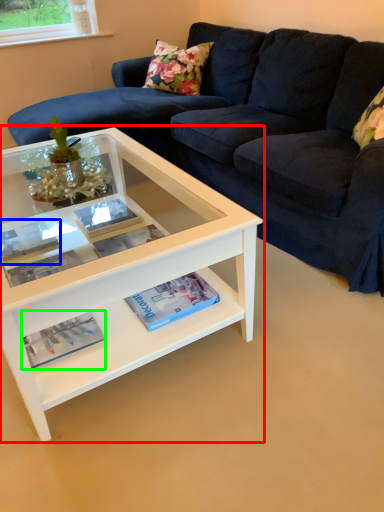
Question: Which object is the farthest from coffee table (highlighted by a red box)? Choose among these: book (highlighted by a blue box) or magazine (highlighted by a green box).

Choices:
 (A) book
 (B) magazine

Answer: (B)